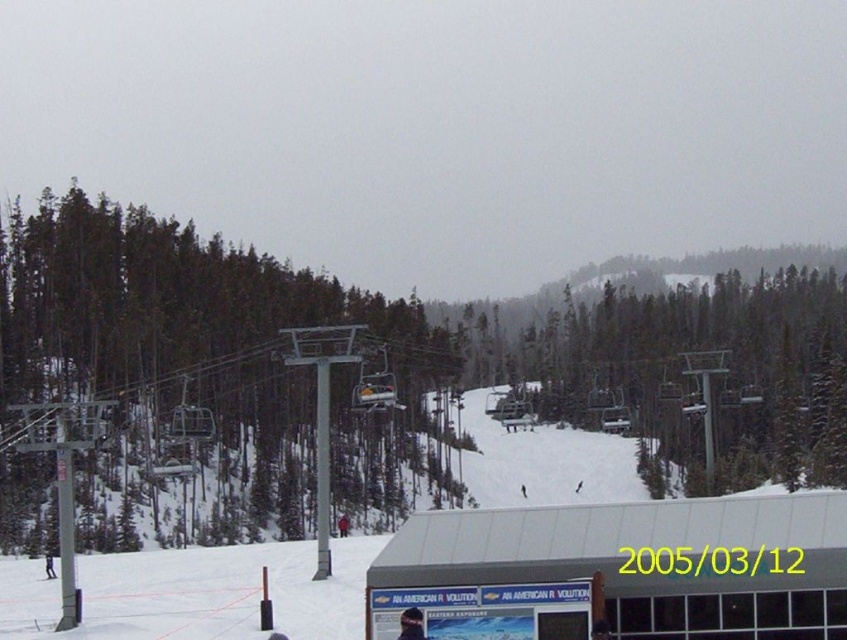
Question: Which object is farther from the camera taking this photo?

Choices:
 (A) white matte building at lower center
 (B) white plastic ski at lower left

Answer: (B)

Question: Is green matte tree at left above white matte building at lower center?

Choices:
 (A) yes
 (B) no

Answer: (B)

Question: Which point appears closest to the camera in this image?

Choices:
 (A) (410, 545)
 (B) (252, 488)
 (C) (50, 570)

Answer: (A)

Question: Can you confirm if white matte building at lower center is positioned to the left of white plastic ski at lower left?

Choices:
 (A) yes
 (B) no

Answer: (B)

Question: Which point is closer to the camera?

Choices:
 (A) (419, 307)
 (B) (718, 536)
 (C) (54, 576)

Answer: (B)

Question: Can you confirm if green matte tree at left is positioned below white plastic ski at lower left?

Choices:
 (A) yes
 (B) no

Answer: (B)